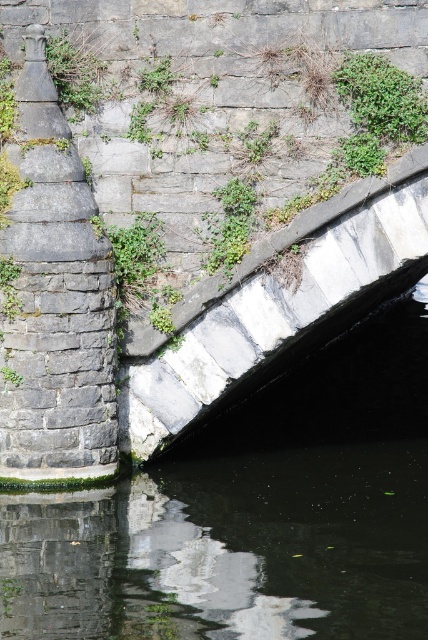
Between point (416, 314) and point (418, 276), which one is positioned behind?

Positioned behind is point (416, 314).

Is black stone river at lower left shorter than stone bridge at center?

In fact, black stone river at lower left may be taller than stone bridge at center.

Who is more distant from viewer, (270, 435) or (416, 250)?

Positioned behind is point (270, 435).

This screenshot has width=428, height=640. I want to click on black stone river at lower left, so click(x=249, y=515).

Is black stone river at lower left to the left of green leafy plant at upper center from the viewer's perspective?

Yes, black stone river at lower left is to the left of green leafy plant at upper center.

Which is above, black stone river at lower left or green leafy plant at upper center?

green leafy plant at upper center

Does point (327, 422) come closer to viewer compared to point (425, 124)?

No, (327, 422) is further to viewer.

Find the location of `black stone river at lower left`. black stone river at lower left is located at coordinates (249, 515).

Does stone bridge at center have a lesser height compared to green leafy plant at upper center?

In fact, stone bridge at center may be taller than green leafy plant at upper center.

Is stone bridge at center above green leafy plant at upper center?

No, stone bridge at center is not above green leafy plant at upper center.

Image resolution: width=428 pixels, height=640 pixels. What do you see at coordinates (278, 314) in the screenshot?
I see `stone bridge at center` at bounding box center [278, 314].

The height and width of the screenshot is (640, 428). What are the coordinates of `stone bridge at center` in the screenshot? It's located at (278, 314).